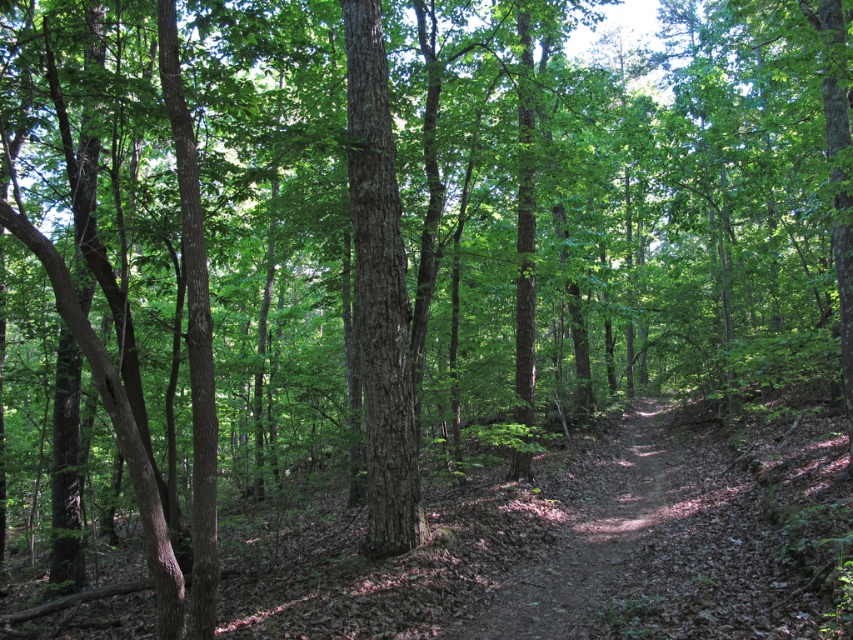
Question: From the image, what is the correct spatial relationship of brown dirt trail at center in relation to smooth brown tree trunk at center?

Choices:
 (A) below
 (B) above

Answer: (A)

Question: Where is brown dirt trail at center located in relation to smooth brown tree trunk at center in the image?

Choices:
 (A) below
 (B) above

Answer: (A)

Question: Which object appears closest to the camera in this image?

Choices:
 (A) brown dirt trail at center
 (B) smooth brown tree trunk at center

Answer: (A)

Question: Which of the following is the closest to the observer?

Choices:
 (A) (583, 566)
 (B) (392, 180)

Answer: (B)

Question: Is brown dirt trail at center in front of smooth brown tree trunk at center?

Choices:
 (A) no
 (B) yes

Answer: (B)

Question: Which point is closer to the camera taking this photo?

Choices:
 (A) (465, 627)
 (B) (389, 189)

Answer: (A)